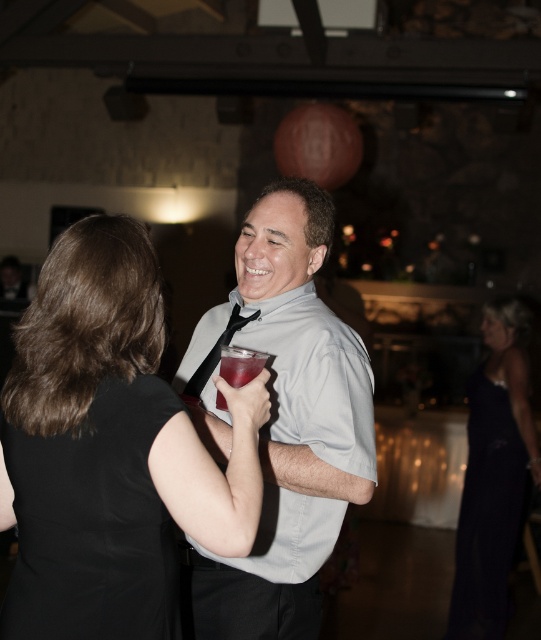
Is gray matte shirt at center to the right of translucent plastic cup at center from the viewer's perspective?

Correct, you'll find gray matte shirt at center to the right of translucent plastic cup at center.

Is gray matte shirt at center positioned before translucent plastic cup at center?

That is False.

Is point (176, 371) farther from viewer compared to point (260, 352)?

Yes, point (176, 371) is behind point (260, 352).

In order to click on gray matte shirt at center in this screenshot , I will do `click(286, 420)`.

Between black smooth dress at center and dark velvet dress at lower right, which one appears on the right side from the viewer's perspective?

dark velvet dress at lower right

Is black smooth dress at center to the right of dark velvet dress at lower right from the viewer's perspective?

No, black smooth dress at center is not to the right of dark velvet dress at lower right.

Does point (17, 461) lie behind point (474, 592)?

No, it is not.

Where is `black smooth dress at center`? Image resolution: width=541 pixels, height=640 pixels. black smooth dress at center is located at coordinates (94, 524).

Is black fabric dress at center positioned behind dark velvet dress at lower right?

That is False.

Can you confirm if black fabric dress at center is positioned below dark velvet dress at lower right?

No, black fabric dress at center is not below dark velvet dress at lower right.

Which is behind, point (23, 525) or point (491, 472)?

The point (491, 472) is behind.

This screenshot has height=640, width=541. In order to click on black fabric dress at center in this screenshot , I will do (110, 449).